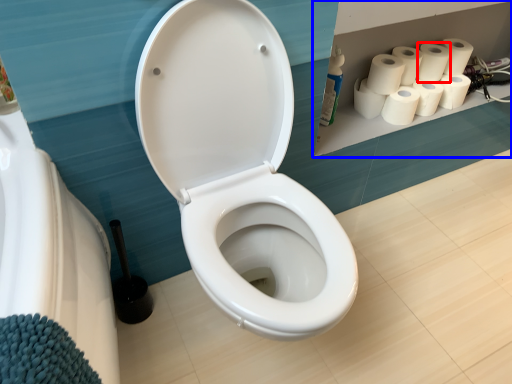
Question: Which point is closer to the camera, paper towel (highlighted by a red box) or shelf (highlighted by a blue box)?

Choices:
 (A) paper towel
 (B) shelf

Answer: (B)